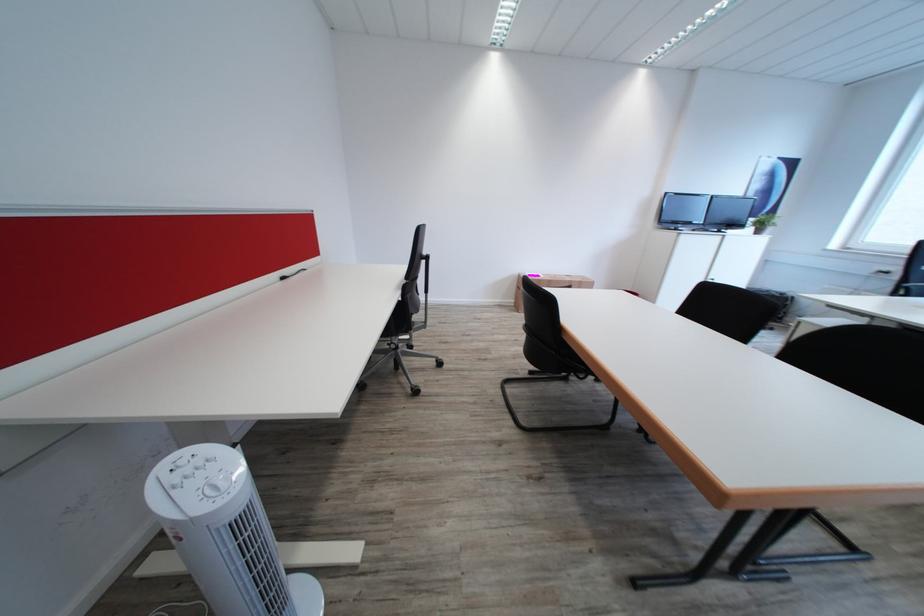
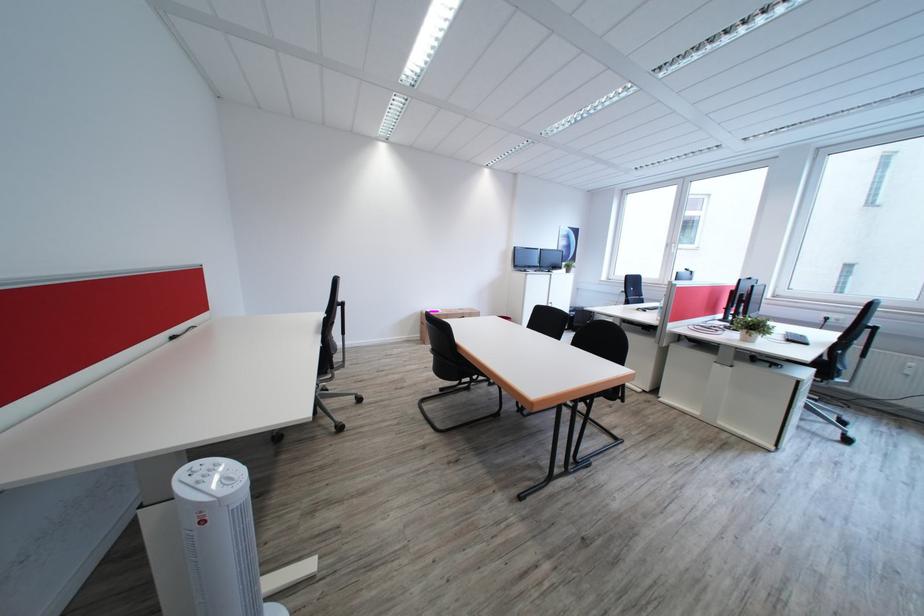
Where in the second image is the point corresponding to point 184,495 from the first image?

(209, 488)